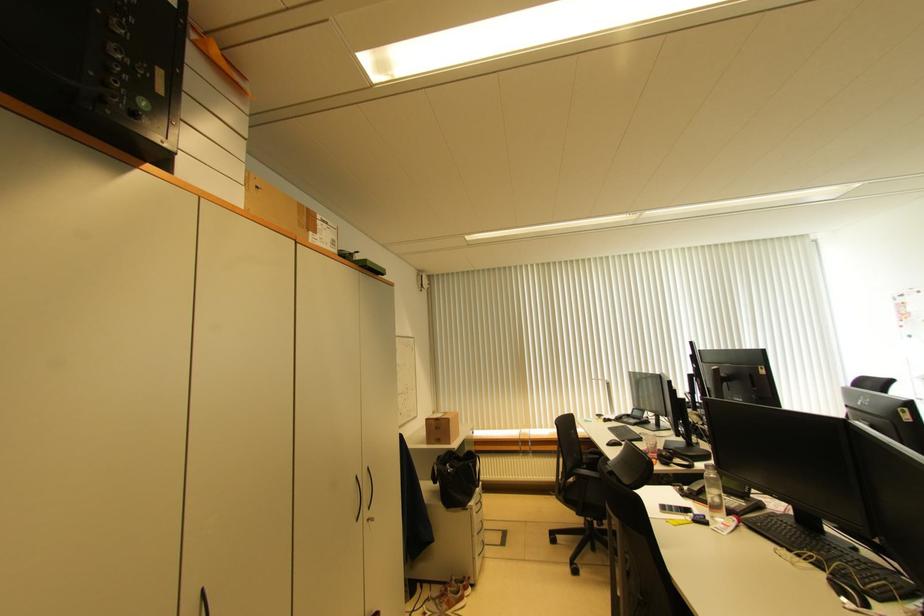
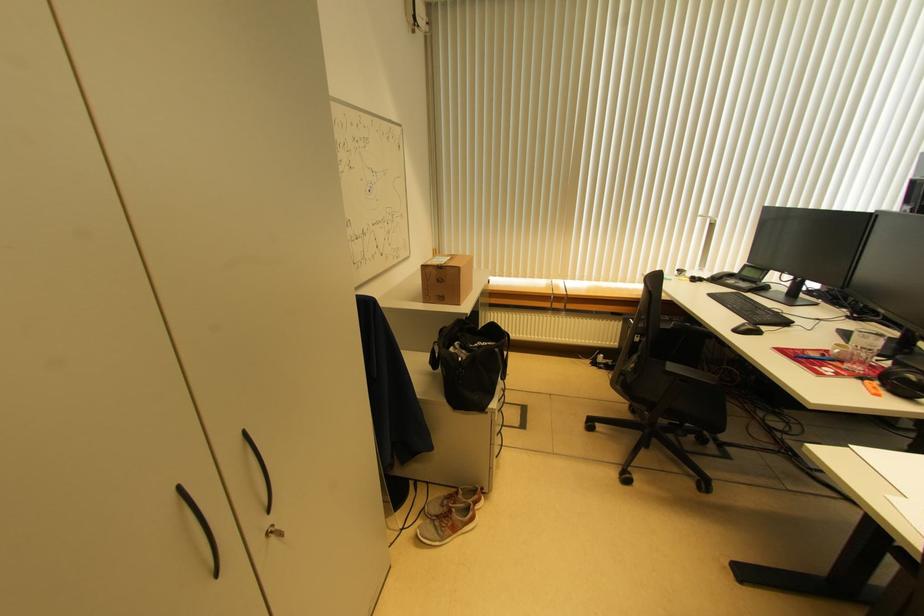
Find the pixel in the second image that matches the point at 472,467 in the first image.

(499, 353)